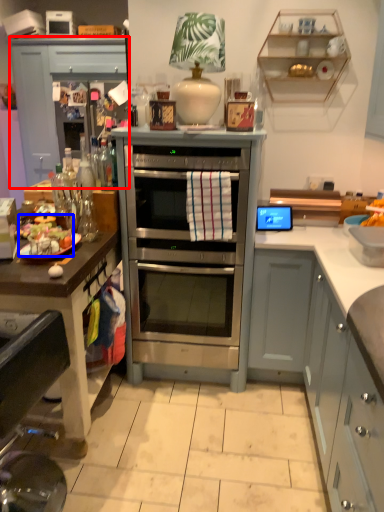
Question: Which of the following is the closest to the observer, cabinetry (highlighted by a red box) or food (highlighted by a blue box)?

Choices:
 (A) cabinetry
 (B) food

Answer: (B)